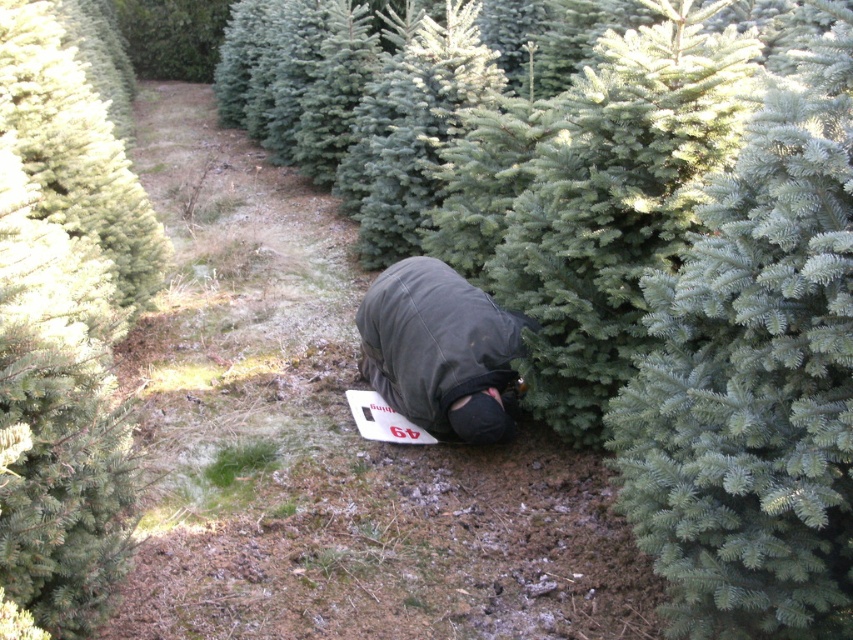
Question: Is green matte evergreen tree at center to the right of dark gray fabric snowboard at center from the viewer's perspective?

Choices:
 (A) no
 (B) yes

Answer: (A)

Question: Which point is farther to the camera?

Choices:
 (A) (432, 406)
 (B) (83, 330)

Answer: (A)

Question: Is green matte evergreen tree at center to the left of dark gray fabric snowboard at center from the viewer's perspective?

Choices:
 (A) yes
 (B) no

Answer: (A)

Question: Does green matte evergreen tree at center have a lesser width compared to dark gray fabric snowboard at center?

Choices:
 (A) no
 (B) yes

Answer: (A)